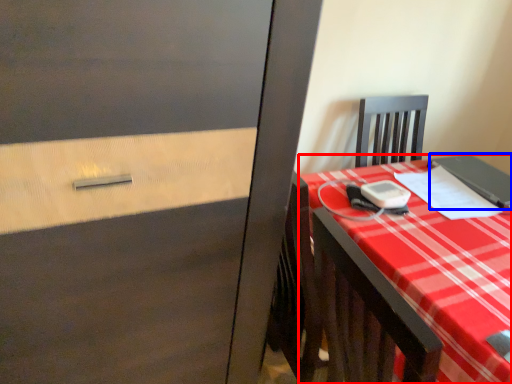
Question: Which object appears closest to the camera in this image, desk (highlighted by a red box) or notebook (highlighted by a blue box)?

Choices:
 (A) desk
 (B) notebook

Answer: (A)